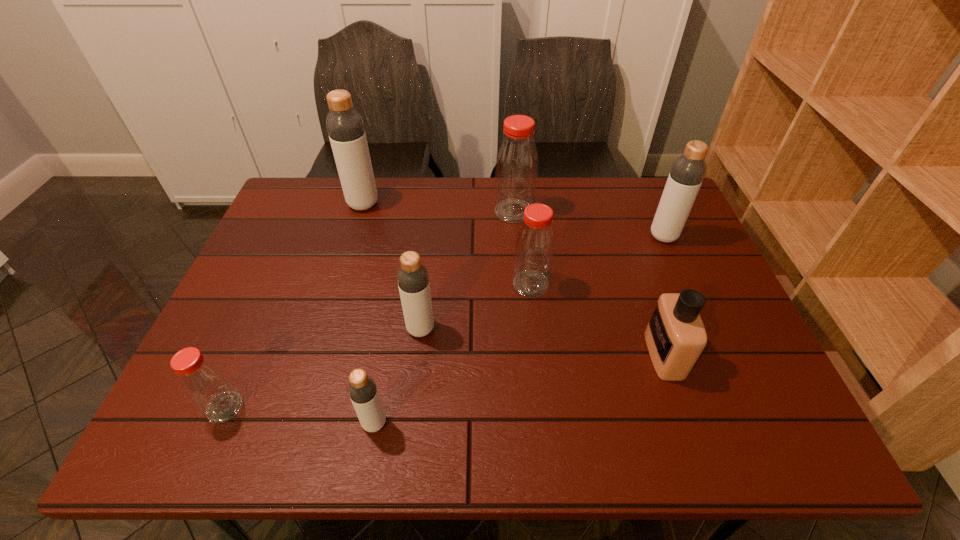
You are a GUI agent. You are given a task and a screenshot of the screen. Output one action in this format:
    pyautogui.click(x=<x>, y=<y>)
    Task: Click on the second object from left to right
    
    Given the screenshot: What is the action you would take?
    pyautogui.click(x=345, y=127)

Locate an element on the screen. the leftmost gray bottle is located at coordinates (345, 127).

Image resolution: width=960 pixels, height=540 pixels. I want to click on the biggest red bottle, so click(516, 166).

You are a GUI agent. You are given a task and a screenshot of the screen. Output one action in this format:
    pyautogui.click(x=<x>, y=<y>)
    Task: Click on the third farthest bottle
    The image size is (960, 540).
    Given the screenshot: What is the action you would take?
    pyautogui.click(x=685, y=178)

Where is `the rightmost bottle`? the rightmost bottle is located at coordinates (685, 178).

The image size is (960, 540). Identify the location of the fourth farthest bottle. (534, 249).

Find the location of a particular element. the fourth farthest object is located at coordinates (534, 249).

Where is `the third biggest gray bottle`? the third biggest gray bottle is located at coordinates (412, 277).

Locate an element on the screen. The width and height of the screenshot is (960, 540). the fourth object from left to right is located at coordinates (412, 277).

I want to click on beige perfume, so click(x=675, y=336).